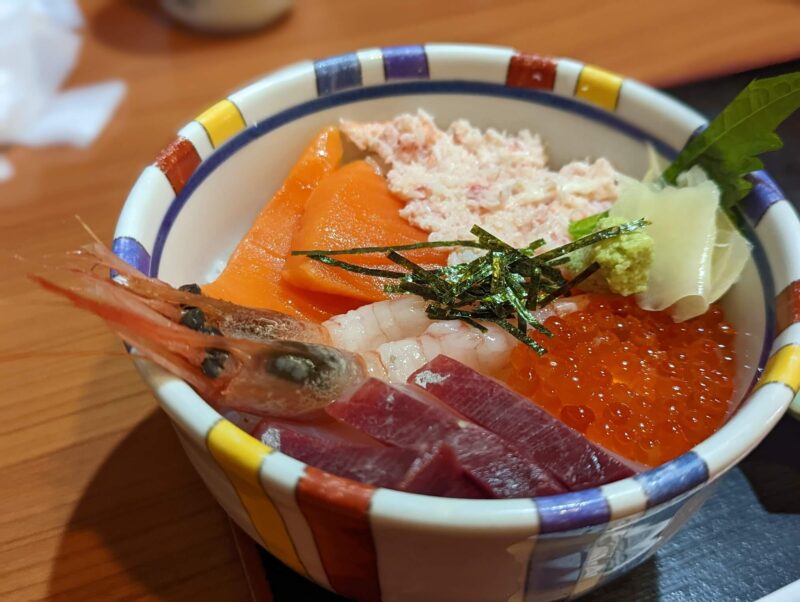
Identify the location of open brown table space left side. (34, 203), (46, 367), (40, 500).